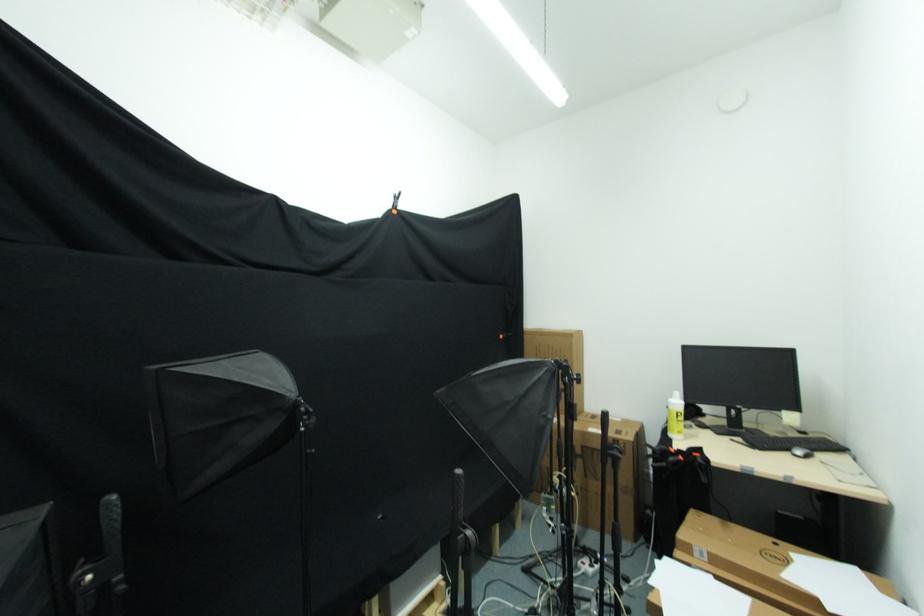
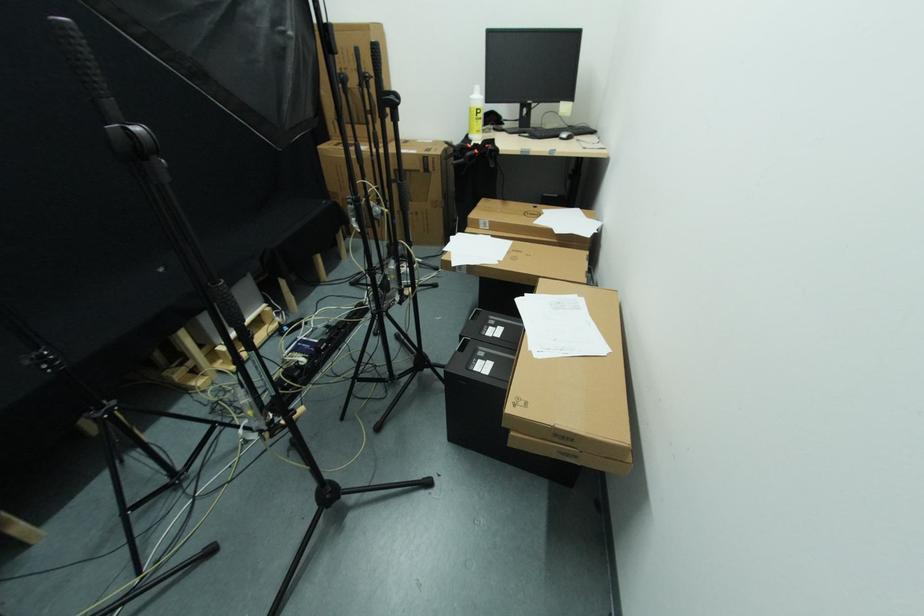
The point at (682, 418) is marked in the first image. Where is the corresponding point in the second image?

(481, 114)